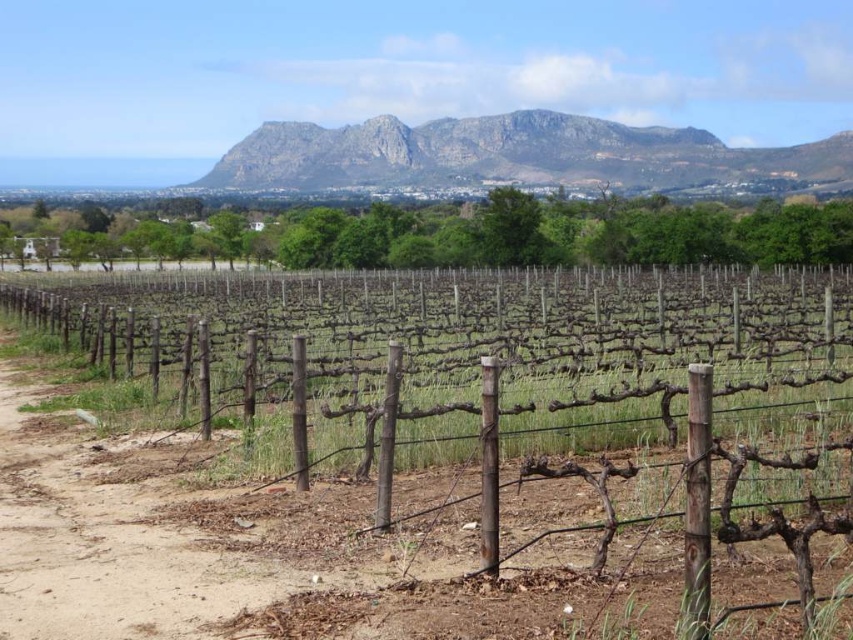
You are planning to install a new fence in your vineyard that needs to be as large as the brown wooden fence at center. You also noticed the rugged stone mountain at upper center in the distance. Which object in the image is bigger in size?

The brown wooden fence at center is larger in size compared to the rugged stone mountain at upper center.

You are standing in the vineyard and want to take a photo of the rugged stone mountain at upper center. However, you notice the brown wooden fence at center is blocking your view. Can you still see the mountain through the fence?

The brown wooden fence at center is closer to the viewer than the rugged stone mountain at upper center, so yes, you can still see the mountain through the fence because the fence is in front but not completely obscuring the mountain behind it.

You are a painter standing at the edge of the vineyard and want to capture the scene. You notice the brown wooden fence at center and the rugged stone mountain at upper center. Which object will appear taller in your painting?

The rugged stone mountain at upper center appears taller than the brown wooden fence at center in the painting because the mountain is much larger in actual size, even though it is farther away.